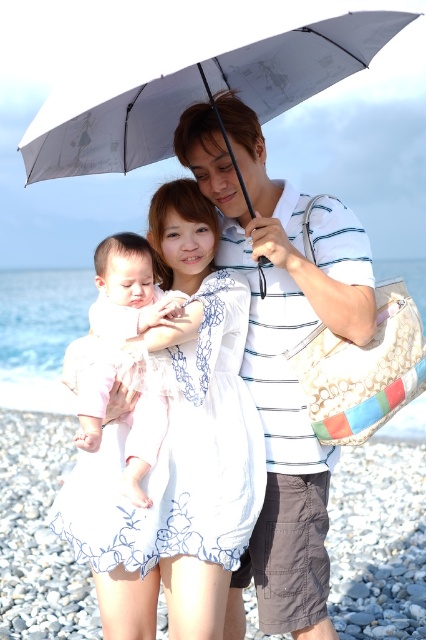
Question: Can you confirm if white embroidered dress at center is positioned to the left of white striped polo shirt at center?

Choices:
 (A) yes
 (B) no

Answer: (A)

Question: Which point is closer to the camera?

Choices:
 (A) gray fabric umbrella at upper center
 (B) light pink fabric baby at center
 (C) white striped polo shirt at center
 (D) white embroidered dress at center

Answer: (A)

Question: Can you confirm if gray fabric umbrella at upper center is wider than light pink fabric baby at center?

Choices:
 (A) no
 (B) yes

Answer: (B)

Question: Can you confirm if gray fabric umbrella at upper center is wider than light pink fabric baby at center?

Choices:
 (A) no
 (B) yes

Answer: (B)

Question: Which of the following is the farthest from the observer?

Choices:
 (A) (172, 282)
 (B) (80, 436)
 (C) (373, 54)

Answer: (C)

Question: Which is nearer to the white striped polo shirt at center?

Choices:
 (A) white embroidered dress at center
 (B) light pink fabric baby at center
 (C) gray fabric umbrella at upper center

Answer: (A)